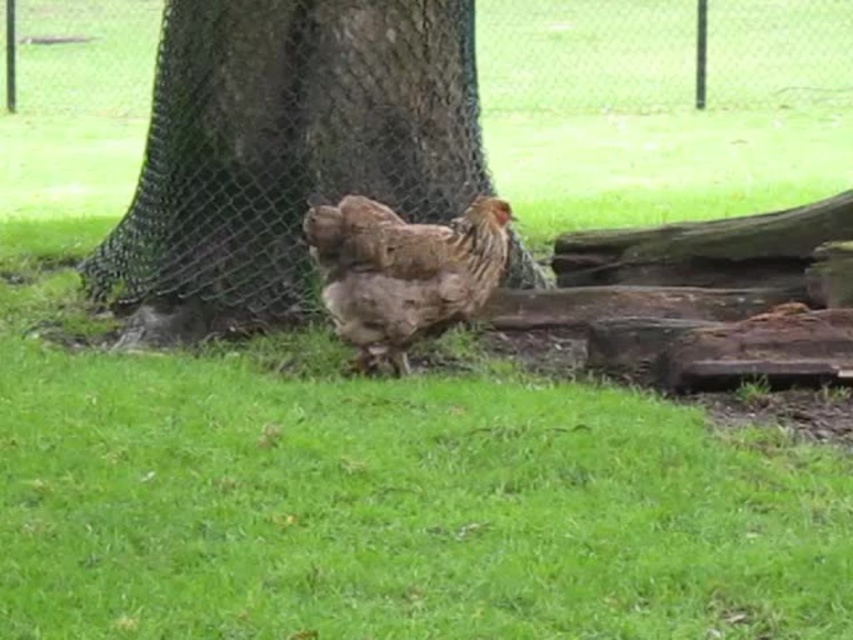
Is brown textured tree trunk at center thinner than brown feathered chicken at center?

In fact, brown textured tree trunk at center might be wider than brown feathered chicken at center.

Is brown textured tree trunk at center to the left of brown feathered chicken at center from the viewer's perspective?

Yes, brown textured tree trunk at center is to the left of brown feathered chicken at center.

Image resolution: width=853 pixels, height=640 pixels. What do you see at coordinates (285, 148) in the screenshot?
I see `brown textured tree trunk at center` at bounding box center [285, 148].

In order to click on brown textured tree trunk at center in this screenshot , I will do `click(285, 148)`.